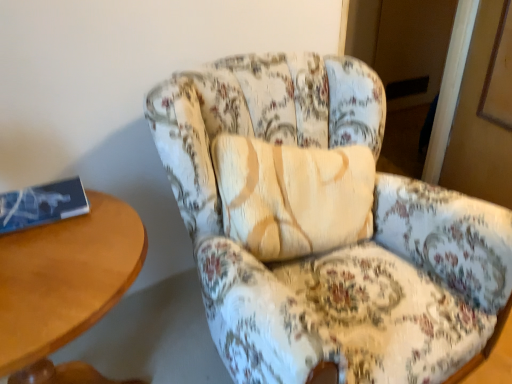
Question: Is wooden table at left facing towards blue paper book at left?

Choices:
 (A) yes
 (B) no

Answer: (B)

Question: Is wooden table at left looking in the opposite direction of blue paper book at left?

Choices:
 (A) no
 (B) yes

Answer: (A)

Question: Is blue paper book at left located within wooden table at left?

Choices:
 (A) yes
 (B) no

Answer: (A)

Question: Considering the relative positions of wooden table at left and blue paper book at left in the image provided, is wooden table at left to the right of blue paper book at left from the viewer's perspective?

Choices:
 (A) yes
 (B) no

Answer: (A)

Question: Considering the relative sizes of wooden table at left and blue paper book at left in the image provided, is wooden table at left smaller than blue paper book at left?

Choices:
 (A) yes
 (B) no

Answer: (B)

Question: From a real-world perspective, is wooden table at left over blue paper book at left?

Choices:
 (A) yes
 (B) no

Answer: (B)

Question: Does wooden table at left have a lesser width compared to floral fabric armchair at center?

Choices:
 (A) no
 (B) yes

Answer: (B)

Question: From a real-world perspective, does wooden table at left sit lower than floral fabric armchair at center?

Choices:
 (A) no
 (B) yes

Answer: (B)

Question: Does wooden table at left come behind floral fabric armchair at center?

Choices:
 (A) yes
 (B) no

Answer: (A)

Question: Is wooden table at left next to floral fabric armchair at center and touching it?

Choices:
 (A) no
 (B) yes

Answer: (A)

Question: Is wooden table at left at the left side of floral fabric armchair at center?

Choices:
 (A) yes
 (B) no

Answer: (A)

Question: From the image's perspective, is wooden table at left on floral fabric armchair at center?

Choices:
 (A) no
 (B) yes

Answer: (A)

Question: From a real-world perspective, is floral fabric armchair at center physically below wooden table at left?

Choices:
 (A) no
 (B) yes

Answer: (A)